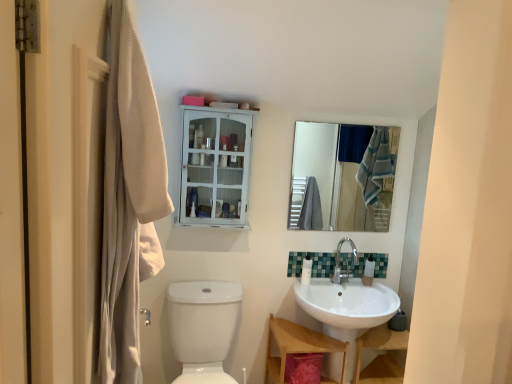
Where is `blank space situated above white wooden cabinet at upper center (from a real-world perspective)`? blank space situated above white wooden cabinet at upper center (from a real-world perspective) is located at coordinates (219, 105).